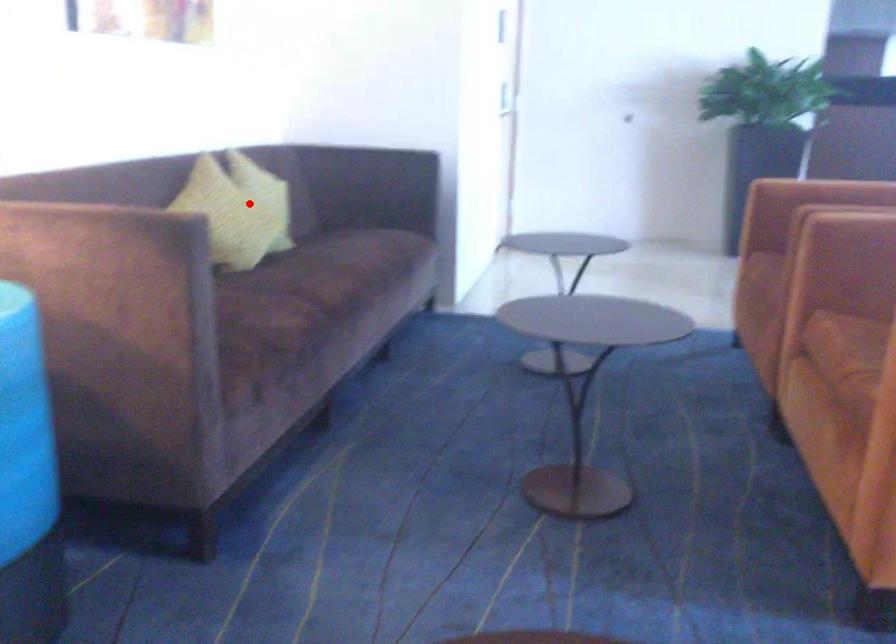
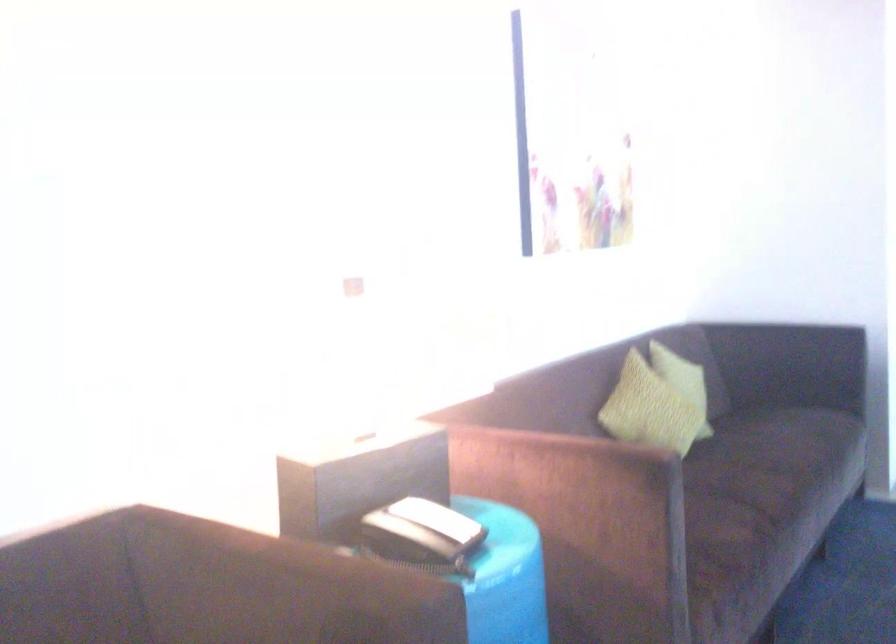
Find the pixel in the second image that matches the highlighted location in the first image.

(683, 381)